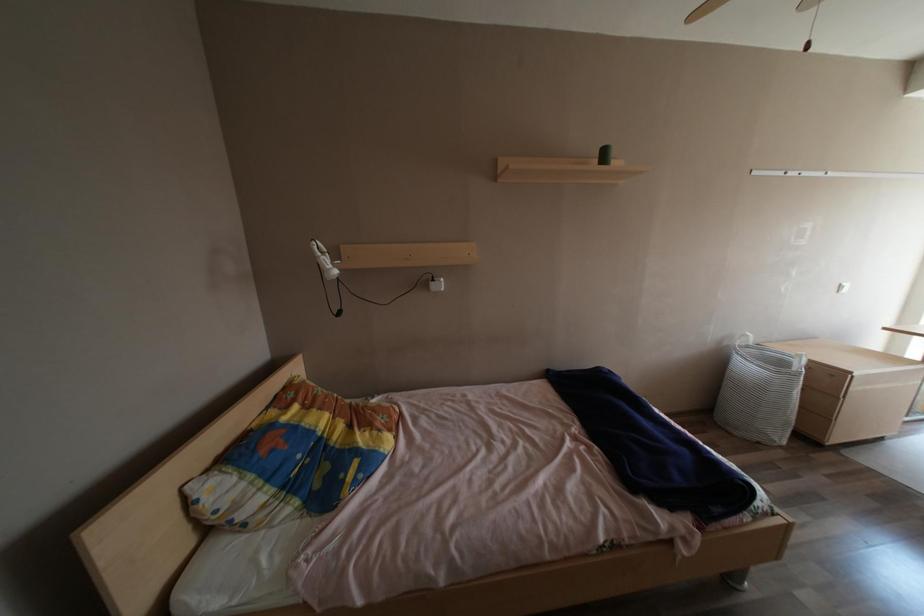
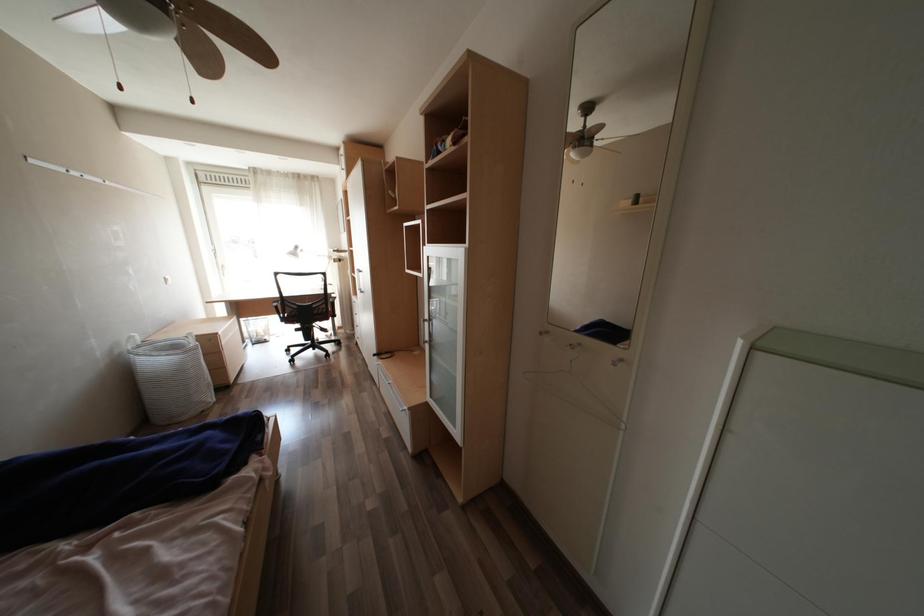
The first image is from the beginning of the video and the second image is from the end. How did the camera likely rotate when shooting the video?

The camera's rotation is toward right-down.